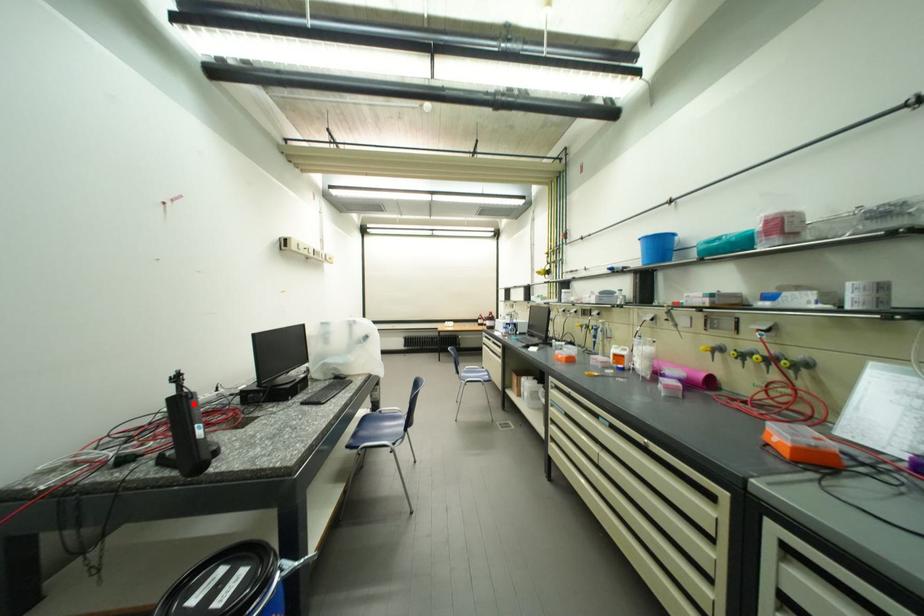
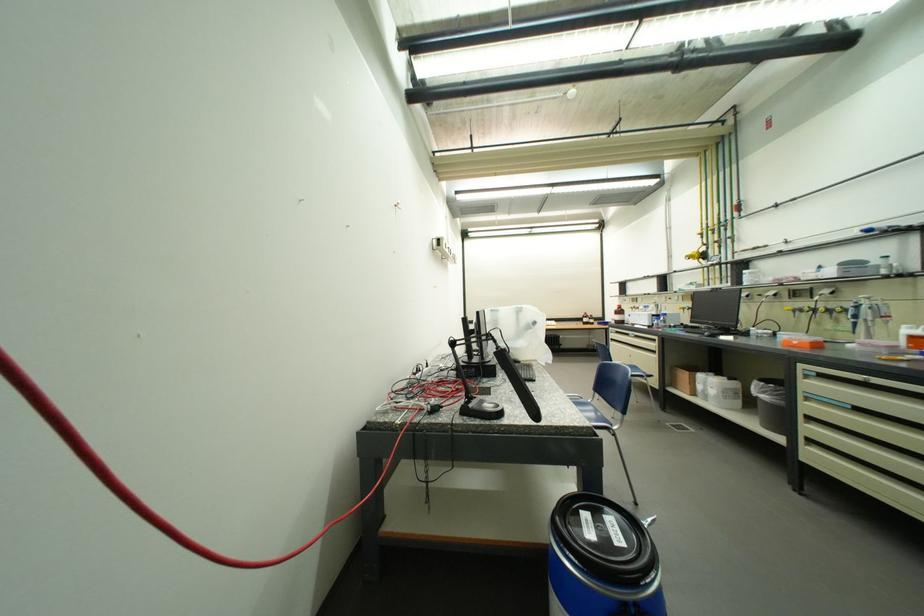
Find the pixel in the second image that matches the highlighted location in the first image.

(517, 358)